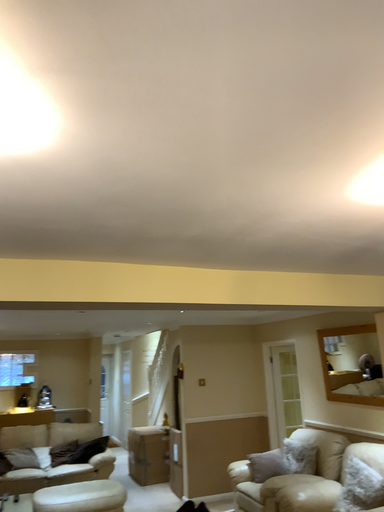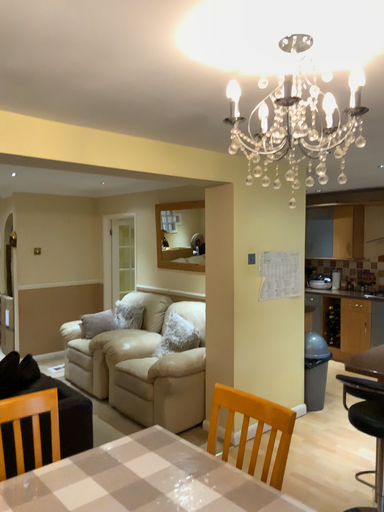
Question: Which way did the camera rotate in the video?

Choices:
 (A) rotated upward
 (B) rotated downward

Answer: (B)